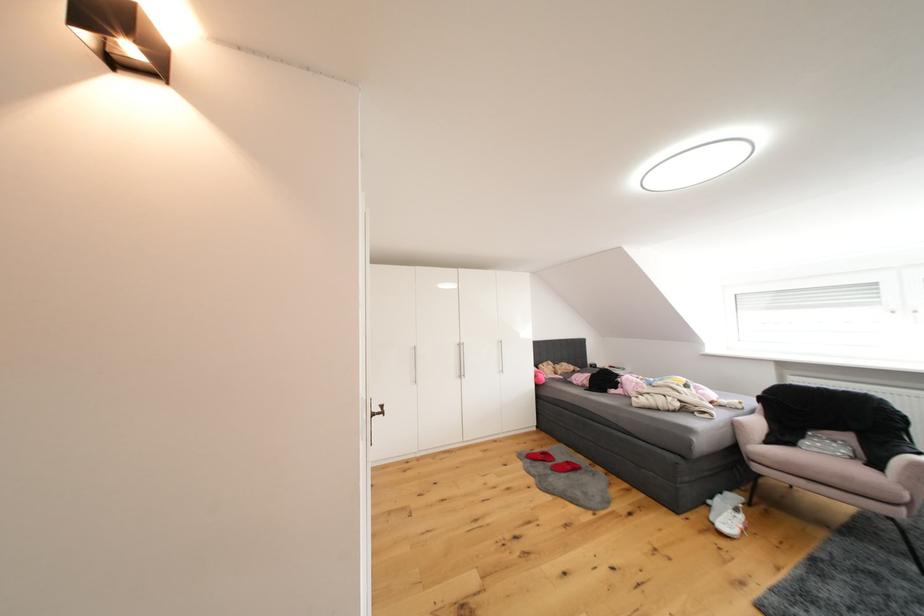
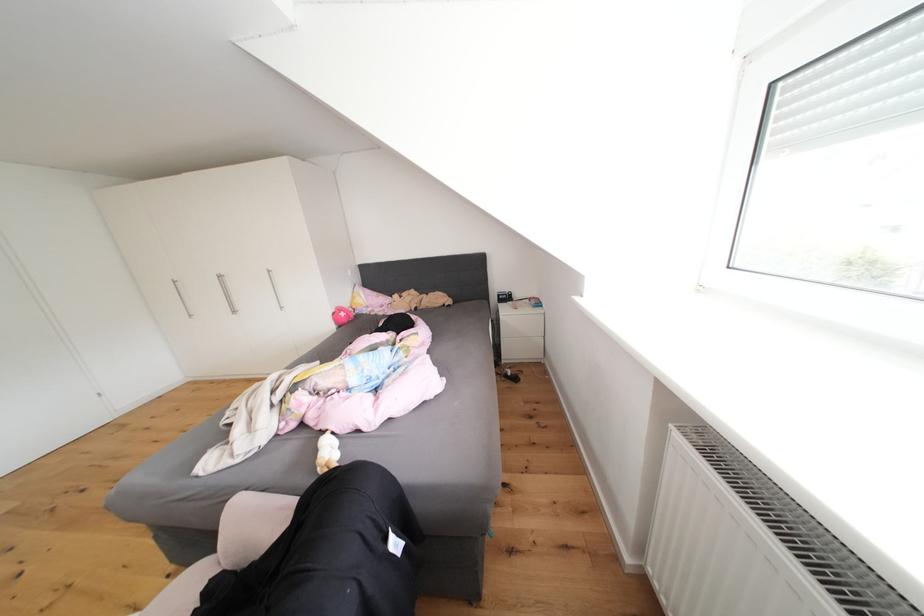
Find the pixel in the second image that matches point (544, 379) in the first image.

(343, 318)